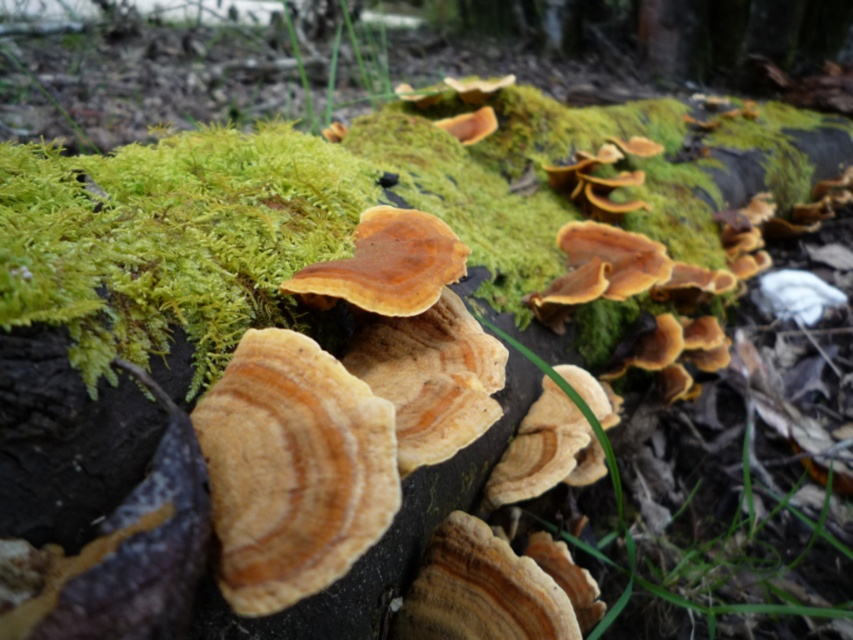
Question: Which point is closer to the camera?

Choices:
 (A) light brown textured fungus at center
 (B) brown wood grain fungi at center

Answer: (A)

Question: Can you confirm if light brown textured fungus at center is positioned below brown wood grain fungi at center?

Choices:
 (A) no
 (B) yes

Answer: (B)

Question: Does light brown textured fungus at center appear on the right side of brown wood grain fungi at center?

Choices:
 (A) yes
 (B) no

Answer: (B)

Question: Which point is closer to the camera?

Choices:
 (A) light brown textured fungus at center
 (B) brown wood grain fungi at center

Answer: (A)

Question: Observing the image, what is the correct spatial positioning of light brown textured fungus at center in reference to brown wood grain fungi at center?

Choices:
 (A) left
 (B) right

Answer: (A)